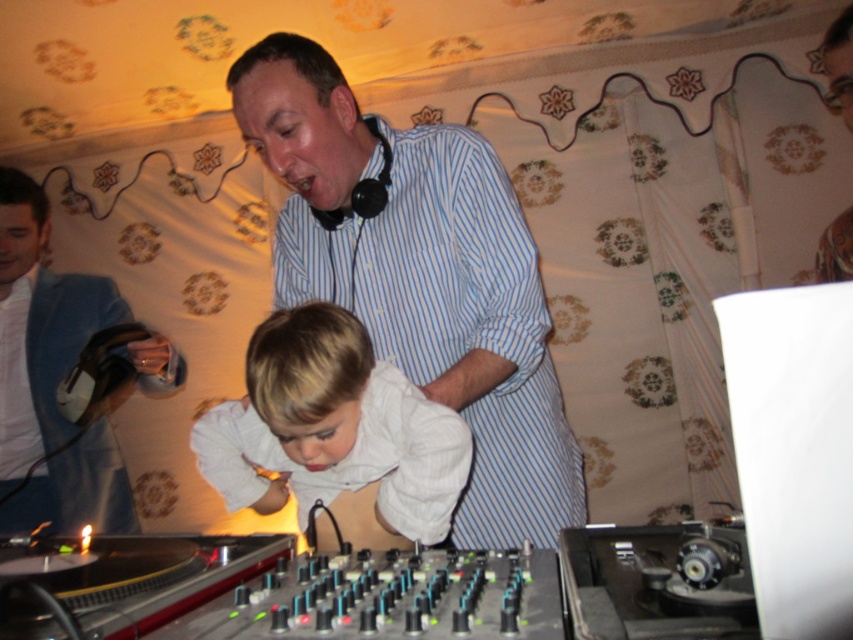
You are standing in front of the DJ booth and see two points on the equipment. The first point is at coordinate point (479, 140) and the second is at point (253, 333). Which point is closer to you?

Point (479, 140) is further to the viewer than point (253, 333), so the second point at (253, 333) is closer to you.

Based on the photo, you are a photographer at the DJ setup. You want to take a photo of the DJ booth and the man in the blue and white striped shirt. The camera you are using has a field of view that can only capture objects within a 0.5 unit radius from the center point. Since the white shirt at center is represented by point (334,428), will the man in the blue and white striped shirt be fully captured in the photo?

The white shirt at center is represented by point (334,428). Since the man in the blue and white striped shirt is wearing the white shirt at center, the man will be fully captured in the photo as the point is within the 0.5 unit radius from the center.

You are at a party and want to find the DJ. You see a white shirt at center and a blue fabric jacket at left. Which one is more likely to be the DJ?

The white shirt at center is more likely to be the DJ because it occupies less space than the blue fabric jacket at left, indicating the person is closer to the DJ equipment in the foreground.